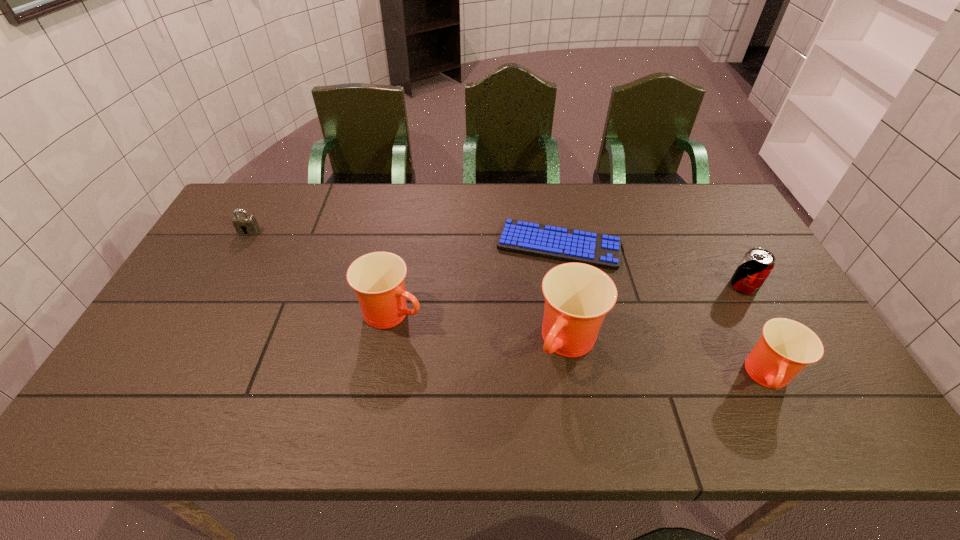
I want to click on the second shortest cup, so click(377, 278).

The width and height of the screenshot is (960, 540). Find the location of `the second tallest object`. the second tallest object is located at coordinates (377, 278).

This screenshot has height=540, width=960. In order to click on the second cup from right to left in this screenshot , I will do `click(578, 296)`.

Identify the location of the rightmost cup. The image size is (960, 540). (786, 347).

You are a GUI agent. You are given a task and a screenshot of the screen. Output one action in this format:
    pyautogui.click(x=<x>, y=<y>)
    Task: Click on the soda can
    The width and height of the screenshot is (960, 540).
    Given the screenshot: What is the action you would take?
    point(756,265)

You are a GUI agent. You are given a task and a screenshot of the screen. Output one action in this format:
    pyautogui.click(x=<x>, y=<y>)
    Task: Click on the computer keyboard
    The width and height of the screenshot is (960, 540).
    Given the screenshot: What is the action you would take?
    pyautogui.click(x=599, y=250)

Find the location of a particular element. This screenshot has height=540, width=960. the second shortest object is located at coordinates (245, 225).

Find the location of a particular element. the leftmost object is located at coordinates (245, 225).

You are a GUI agent. You are given a task and a screenshot of the screen. Output one action in this format:
    pyautogui.click(x=<x>, y=<y>)
    Task: Click on the vacant space situated on the back of the fifth object from right to left
    
    Given the screenshot: What is the action you would take?
    pyautogui.click(x=398, y=277)

Image resolution: width=960 pixels, height=540 pixels. What are the coordinates of `vacant space located on the left of the second cup from right to left` in the screenshot? It's located at (386, 343).